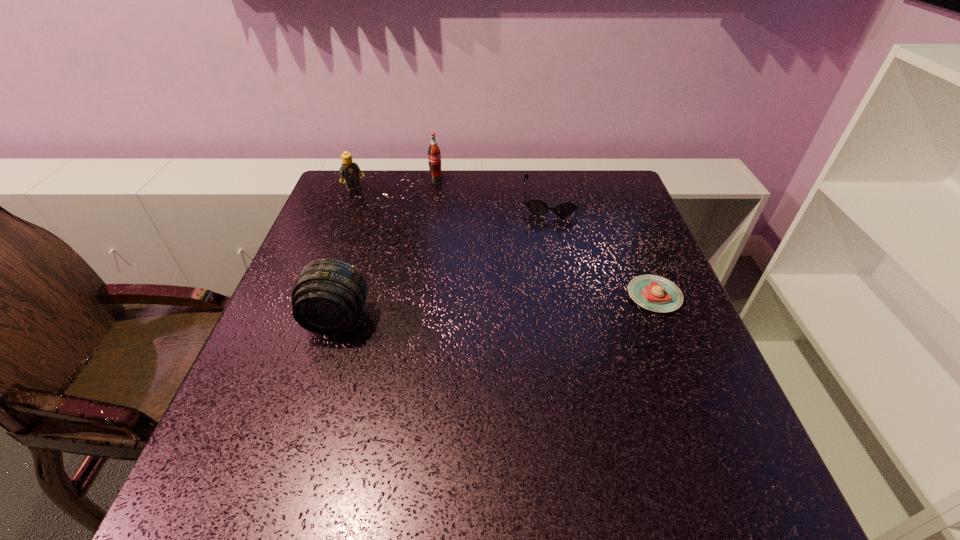
At what (x,y) coordinates should I click in order to perform the action: click on vacant spot on the desktop that is between the telephoto lens and the shortest object and is positioned in front of the third tallest object. Please return your answer as a coordinate pair (x, y). This screenshot has width=960, height=540. Looking at the image, I should click on (459, 310).

Find the location of a particular element. This screenshot has width=960, height=540. vacant spot on the desktop that is between the telephoto lens and the shortest object and is positioned on the lenses of the sunglasses is located at coordinates (545, 304).

Locate an element on the screen. This screenshot has height=540, width=960. vacant space on the desktop that is between the telephoto lens and the shortest object and is positioned on the label of the third object from right to left is located at coordinates (519, 306).